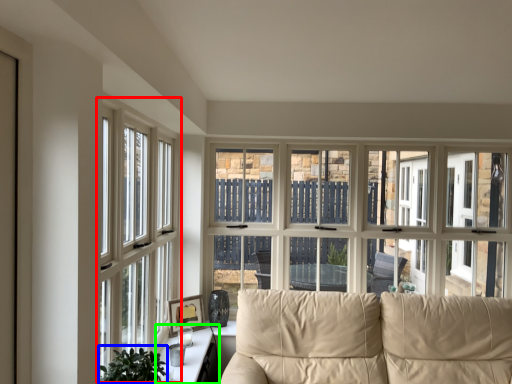
Question: Considering the real-world distances, which object is farthest from window (highlighted by a red box)? plant (highlighted by a blue box) or table (highlighted by a green box)?

Choices:
 (A) plant
 (B) table

Answer: (A)